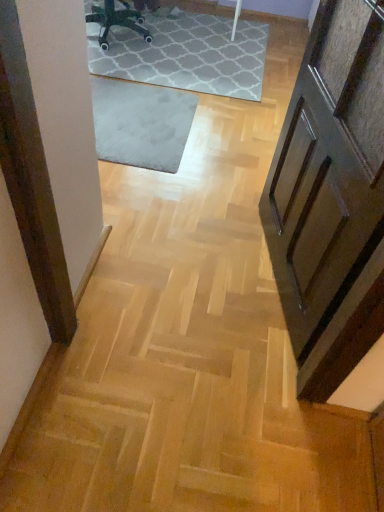
Where is `vacant region to the left of black plastic chair at upper center`? This screenshot has width=384, height=512. vacant region to the left of black plastic chair at upper center is located at coordinates (106, 41).